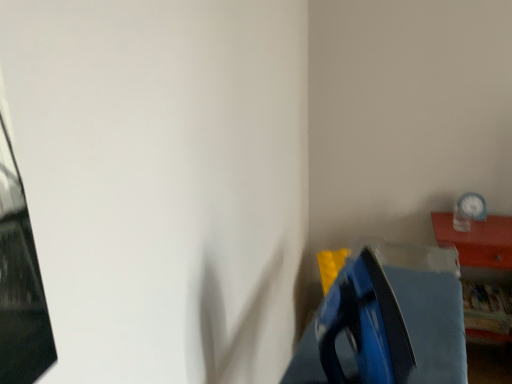
Question: Considering the relative positions of wooden clock at upper right and white plastic clock at upper right in the image provided, is wooden clock at upper right behind white plastic clock at upper right?

Choices:
 (A) no
 (B) yes

Answer: (A)

Question: Is white plastic clock at upper right a part of wooden clock at upper right?

Choices:
 (A) no
 (B) yes

Answer: (A)

Question: Does wooden clock at upper right have a greater height compared to white plastic clock at upper right?

Choices:
 (A) yes
 (B) no

Answer: (A)

Question: Is wooden clock at upper right at the left side of white plastic clock at upper right?

Choices:
 (A) yes
 (B) no

Answer: (B)

Question: Is wooden clock at upper right not inside white plastic clock at upper right?

Choices:
 (A) yes
 (B) no

Answer: (A)

Question: Are wooden clock at upper right and white plastic clock at upper right located far from each other?

Choices:
 (A) yes
 (B) no

Answer: (B)

Question: Is white plastic clock at upper right placed right next to wooden clock at upper right?

Choices:
 (A) no
 (B) yes

Answer: (A)

Question: From a real-world perspective, does white plastic clock at upper right sit lower than wooden clock at upper right?

Choices:
 (A) yes
 (B) no

Answer: (B)

Question: Is white plastic clock at upper right outside of wooden clock at upper right?

Choices:
 (A) no
 (B) yes

Answer: (B)

Question: Is wooden clock at upper right located within white plastic clock at upper right?

Choices:
 (A) no
 (B) yes

Answer: (A)

Question: Considering the relative positions of white plastic clock at upper right and wooden clock at upper right in the image provided, is white plastic clock at upper right behind wooden clock at upper right?

Choices:
 (A) no
 (B) yes

Answer: (B)

Question: Is white plastic clock at upper right not near wooden clock at upper right?

Choices:
 (A) yes
 (B) no

Answer: (B)

Question: Would you say wooden clock at upper right is to the left or to the right of white plastic clock at upper right in the picture?

Choices:
 (A) right
 (B) left

Answer: (A)